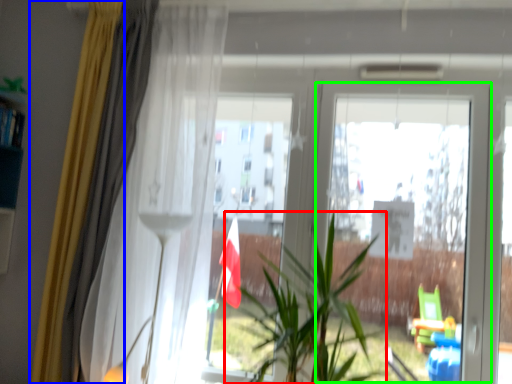
Question: Based on their relative distances, which object is farther from houseplant (highlighted by a red box)? Choose from curtain (highlighted by a blue box) and screen door (highlighted by a green box).

Choices:
 (A) curtain
 (B) screen door

Answer: (A)